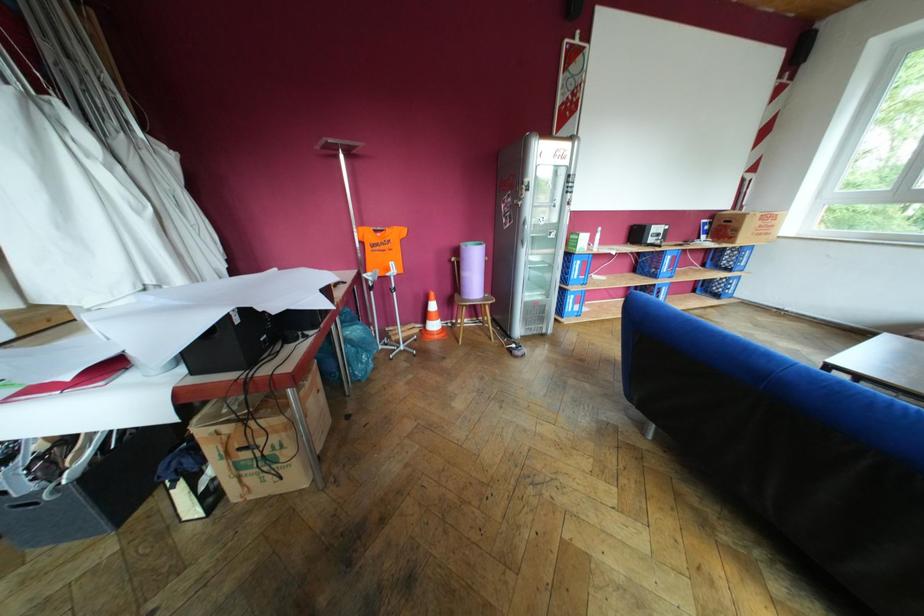
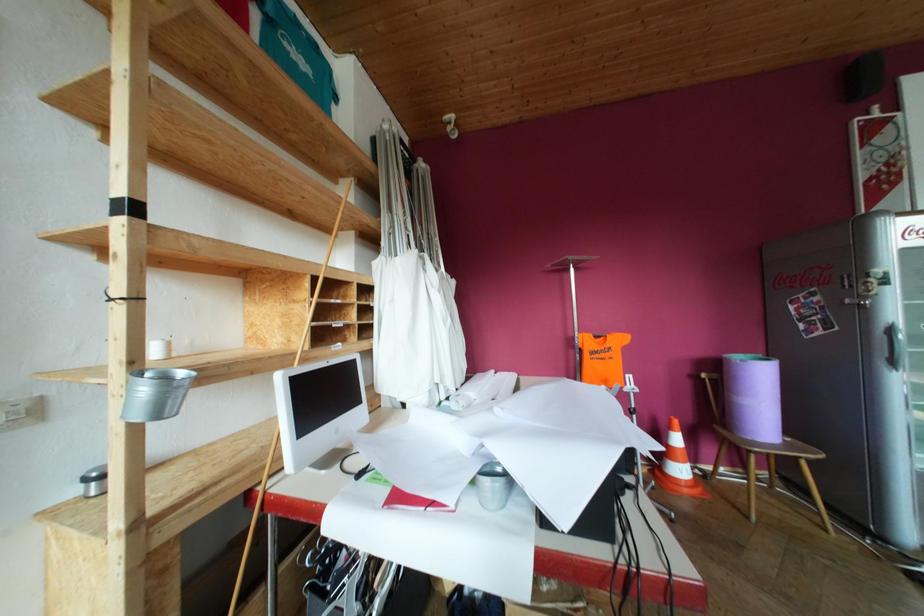
The images are taken continuously from a first-person perspective. In which direction is your viewpoint rotating?

The camera rotated toward left-up.